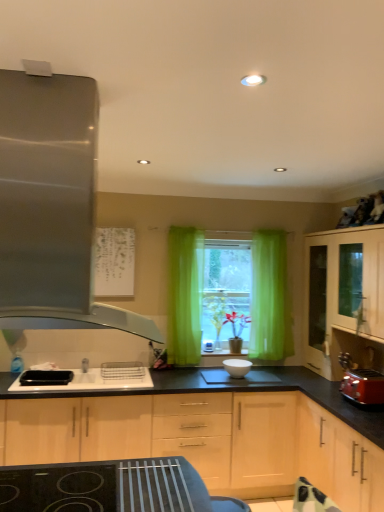
Locate an element on the screen. This screenshot has height=512, width=384. free space in front of white glossy bowl at center is located at coordinates (250, 381).